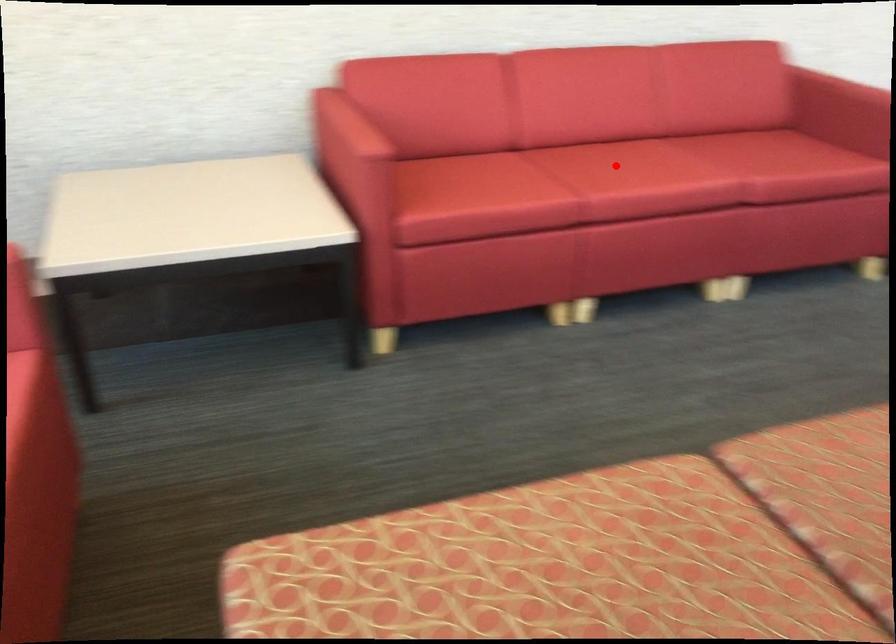
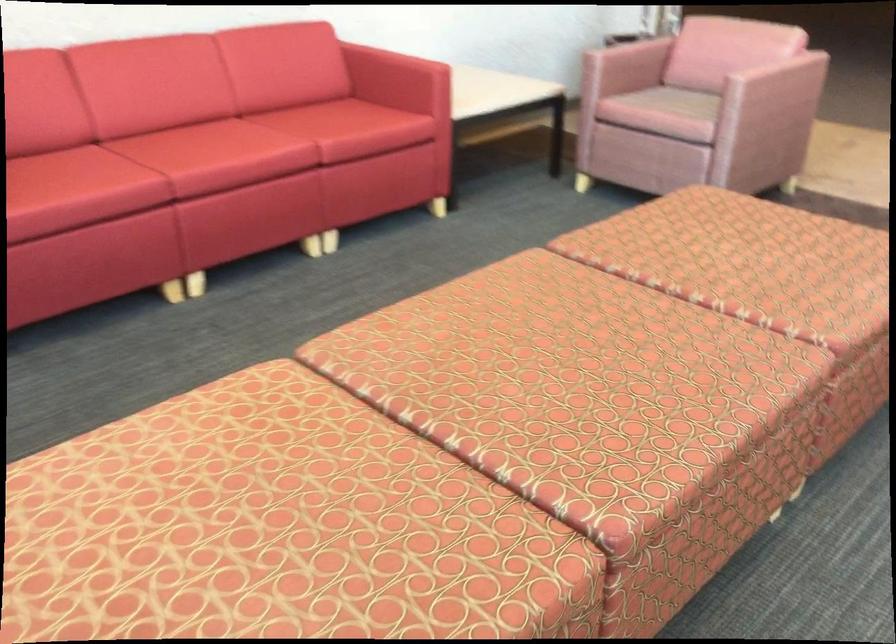
The point at the highlighted location is marked in the first image. Where is the corresponding point in the second image?

(196, 144)